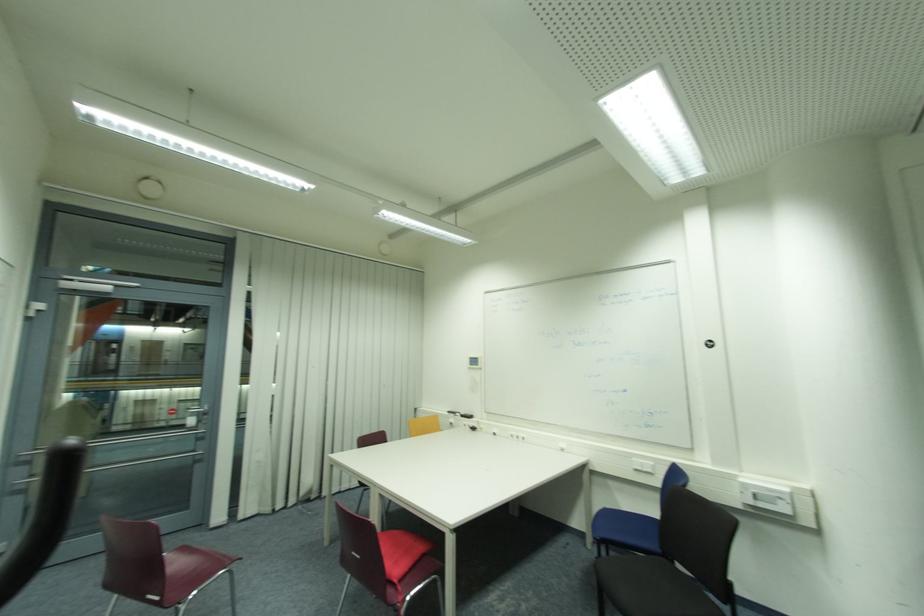
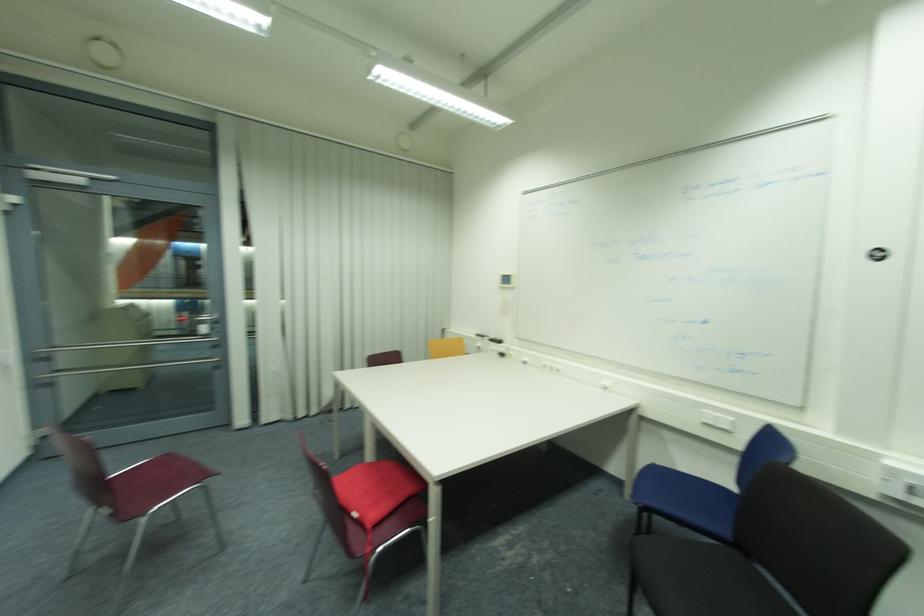
Locate, in the second image, the point that corresponds to (203,422) in the first image.

(217, 330)